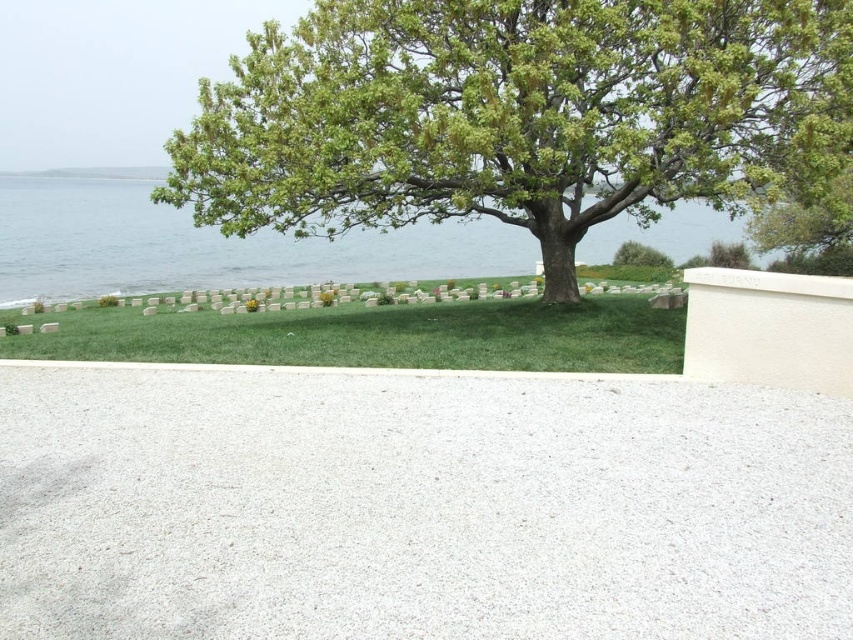
Is green leafy tree at center above green grass at center?

Yes.

Who is shorter, green leafy tree at center or green grass at center?

green grass at center is shorter.

Who is more forward, (376, 224) or (325, 308)?

Point (376, 224) is more forward.

Where is `green leafy tree at center`? The width and height of the screenshot is (853, 640). green leafy tree at center is located at coordinates (517, 115).

This screenshot has height=640, width=853. What do you see at coordinates (517, 115) in the screenshot? I see `green leafy tree at center` at bounding box center [517, 115].

Is green leafy tree at center above green water at upper center?

Actually, green leafy tree at center is below green water at upper center.

Who is more distant from viewer, [225,124] or [347,234]?

The point [347,234] is behind.

Identify the location of green leafy tree at center. The image size is (853, 640). (517, 115).

Is green water at upper center bigger than green grass at center?

Yes, green water at upper center is bigger than green grass at center.

Is green water at upper center to the left of green grass at center from the viewer's perspective?

Correct, you'll find green water at upper center to the left of green grass at center.

Locate an element on the screen. green water at upper center is located at coordinates (212, 246).